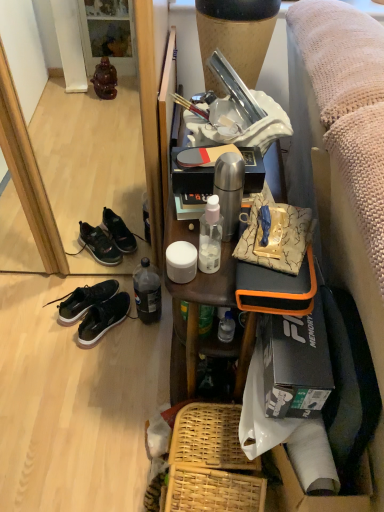
Question: Considering their positions, is matte black mirror at lower left located in front of or behind black matte sneakers at lower left?

Choices:
 (A) front
 (B) behind

Answer: (A)

Question: Considering the positions of matte black mirror at lower left and black matte sneakers at lower left in the image, is matte black mirror at lower left taller or shorter than black matte sneakers at lower left?

Choices:
 (A) tall
 (B) short

Answer: (A)

Question: Which object is positioned closest to the wooden table at upper right?

Choices:
 (A) black matte sneakers at lower left
 (B) matte black mirror at lower left
 (C) translucent plastic bottle at lower left
 (D) woven wood picnic basket at lower center
 (E) black matte sneakers at lower left

Answer: (D)

Question: Estimate the real-world distances between objects in this image. Which object is farther from the wooden table at upper right?

Choices:
 (A) matte black mirror at lower left
 (B) translucent plastic bottle at lower left
 (C) textured beige fabric couch at right
 (D) woven wood picnic basket at lower center
 (E) black matte sneakers at lower left

Answer: (A)